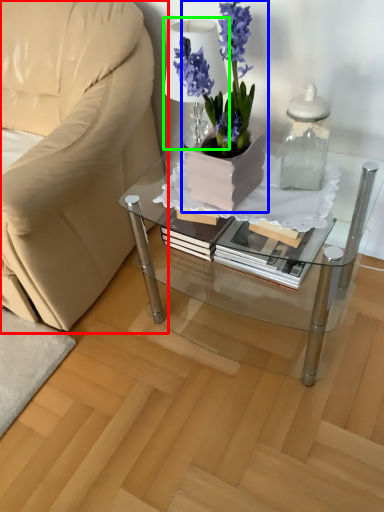
Question: Which object is positioned farthest from chair (highlighted by a red box)? Select from houseplant (highlighted by a blue box) and table lamp (highlighted by a green box).

Choices:
 (A) houseplant
 (B) table lamp

Answer: (A)